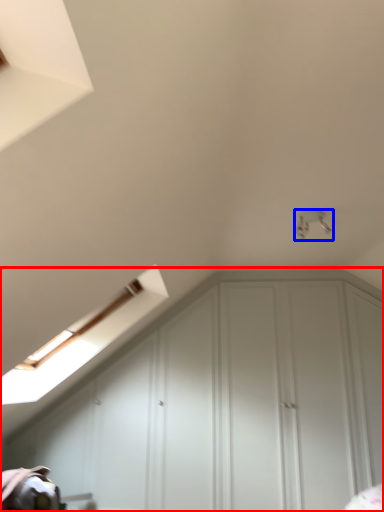
Question: Which object appears closest to the camera in this image, dresser (highlighted by a red box) or light fixture (highlighted by a blue box)?

Choices:
 (A) dresser
 (B) light fixture

Answer: (B)